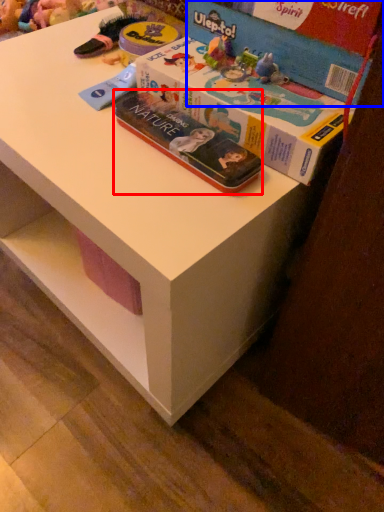
Question: Which point is further to the camera, book (highlighted by a red box) or box (highlighted by a blue box)?

Choices:
 (A) book
 (B) box

Answer: (A)